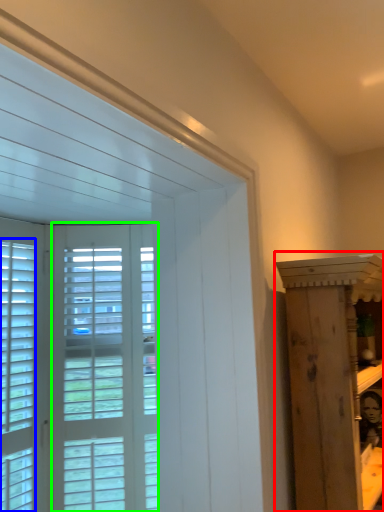
Question: Considering the real-world distances, which object is closest to furniture (highlighted by a red box)? window (highlighted by a blue box) or screen door (highlighted by a green box).

Choices:
 (A) window
 (B) screen door

Answer: (B)